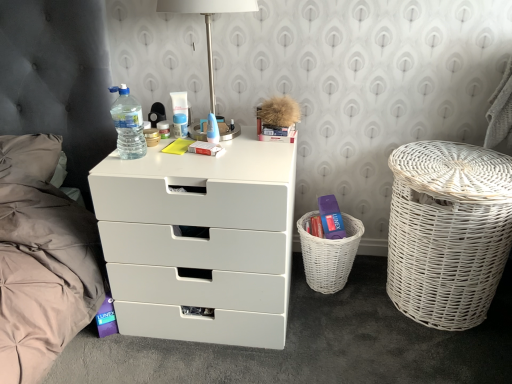
Identify the location of free space to the left of white wicker laundry basket at right. (340, 322).